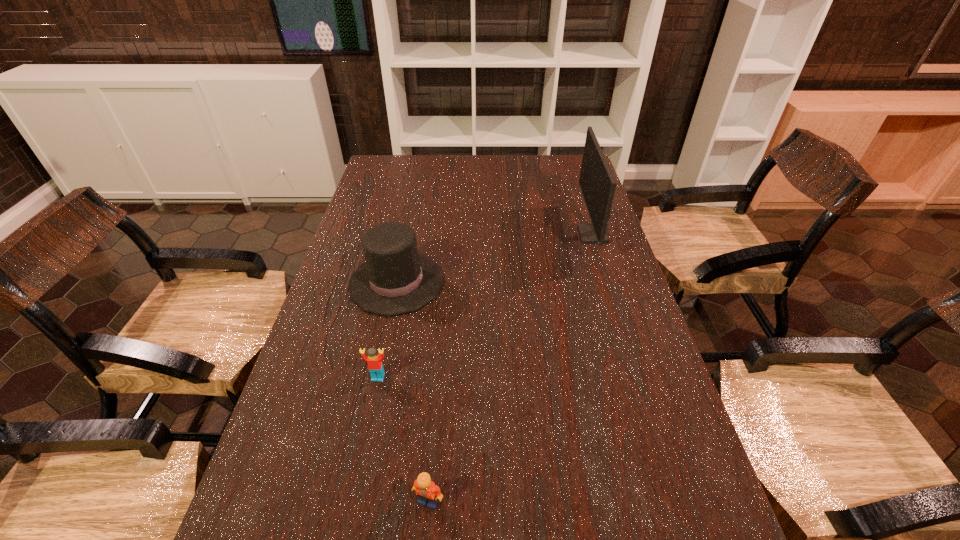
Identify the location of free spot between the dress hat and the nearer Lego. (413, 392).

I want to click on free space that is in between the computer monitor and the second tallest object, so click(x=494, y=258).

Identify the location of vacant area that lies between the computer monitor and the left Lego. (486, 306).

The height and width of the screenshot is (540, 960). In order to click on unoccupied area between the nearer Lego and the second nearest object in this screenshot , I will do `click(403, 439)`.

Find the location of a particular element. free spot between the farther Lego and the rightmost object is located at coordinates (486, 306).

Find the location of a particular element. Image resolution: width=960 pixels, height=540 pixels. empty location between the third farthest object and the second tallest object is located at coordinates (387, 330).

Locate an element on the screen. Image resolution: width=960 pixels, height=540 pixels. the closest object to the tallest object is located at coordinates (395, 279).

The height and width of the screenshot is (540, 960). In order to click on object that is the second closest one to the dress hat in this screenshot , I will do `click(597, 183)`.

At what (x,y) coordinates should I click in order to perform the action: click on vacant area in the image that satisfies the following two spatial constraints: 1. on the front-facing side of the tallest object; 2. on the face of the left Lego. Please return your answer as a coordinate pair (x, y). Looking at the image, I should click on pyautogui.click(x=638, y=377).

You are a GUI agent. You are given a task and a screenshot of the screen. Output one action in this format:
    pyautogui.click(x=<x>, y=<y>)
    Task: Click on the vacant space that satisfies the following two spatial constraints: 1. on the front-facing side of the computer monitor; 2. on the face of the left Lego
    This screenshot has width=960, height=540.
    Given the screenshot: What is the action you would take?
    pyautogui.click(x=638, y=377)